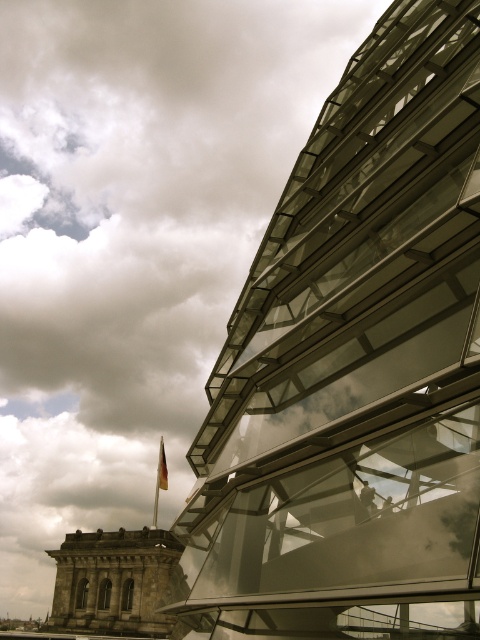
You are standing in front of the two buildings and notice two points marked in the image. The first point is at coordinates point (101, 582) and the second is at point (164, 449). Which point is nearer to you?

Point (101, 582) is closer to the viewer than point (164, 449).